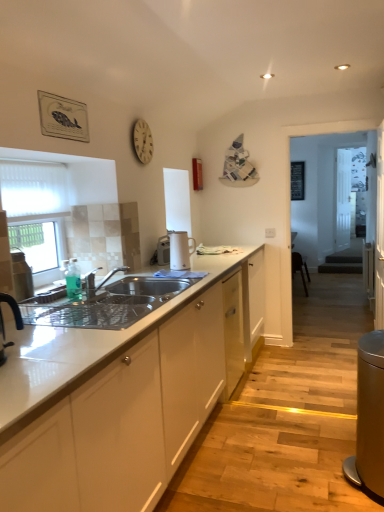
Question: Is satin silver sink at center taller or shorter than white glossy electric kettle at center, which is the first appliance from back to front?

Choices:
 (A) tall
 (B) short

Answer: (B)

Question: Does point (168, 280) appear closer or farther from the camera than point (183, 267)?

Choices:
 (A) closer
 (B) farther

Answer: (A)

Question: Which of these objects is positioned closest to the wooden clock at upper center?

Choices:
 (A) white mesh screen at left
 (B) black rubber tap at left
 (C) transparent glass door at center, which appears as the first glass door when viewed from the front
 (D) black plastic bar stool at right
 (E) white glossy electric kettle at center, which is the 1th appliance from left to right

Answer: (E)

Question: Estimate the real-world distances between objects in this image. Which object is closer to the wooden clock at upper center?

Choices:
 (A) satin silver sink at center
 (B) clear glass door at center, which is the 2th glass door from front to back
 (C) white mesh screen at left
 (D) black rubber tap at left
 (E) transparent glass door at center, which appears as the first glass door when viewed from the front

Answer: (C)